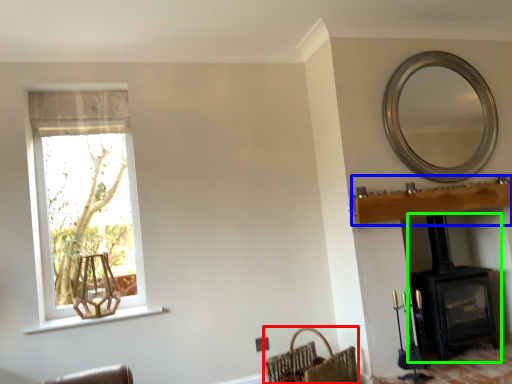
Question: Which object is the closest to the basket (highlighted by a red box)? Choose among these: mantle (highlighted by a blue box) or wood burning stove (highlighted by a green box).

Choices:
 (A) mantle
 (B) wood burning stove

Answer: (B)